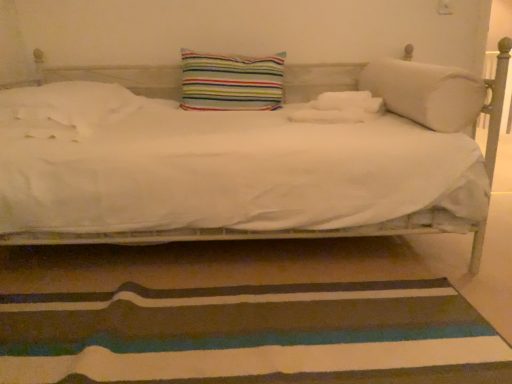
Question: Can we say striped fabric pillow at center, marked as the 2th pillow in a right-to-left arrangement, lies outside white soft cylindrical pillow at right, marked as the 3th pillow in a left-to-right arrangement?

Choices:
 (A) no
 (B) yes

Answer: (B)

Question: Is there a large distance between striped fabric pillow at center, marked as the 2th pillow in a right-to-left arrangement, and white soft cylindrical pillow at right, marked as the 3th pillow in a left-to-right arrangement?

Choices:
 (A) yes
 (B) no

Answer: (B)

Question: Is striped fabric pillow at center, arranged as the 2th pillow when viewed from the left, facing towards white soft cylindrical pillow at right, marked as the 3th pillow in a left-to-right arrangement?

Choices:
 (A) yes
 (B) no

Answer: (B)

Question: Does striped fabric pillow at center, arranged as the 2th pillow when viewed from the left, have a greater height compared to white soft cylindrical pillow at right, marked as the 3th pillow in a left-to-right arrangement?

Choices:
 (A) no
 (B) yes

Answer: (B)

Question: Is striped fabric pillow at center, arranged as the 2th pillow when viewed from the left, wider than white soft cylindrical pillow at right, marked as the 3th pillow in a left-to-right arrangement?

Choices:
 (A) yes
 (B) no

Answer: (B)

Question: Looking at the image, does striped fabric pillow at center, arranged as the 2th pillow when viewed from the left, seem bigger or smaller compared to white soft pillow at left, marked as the 3th pillow in a right-to-left arrangement?

Choices:
 (A) big
 (B) small

Answer: (B)

Question: From the image's perspective, is striped fabric pillow at center, marked as the 2th pillow in a right-to-left arrangement, positioned above or below white soft pillow at left, the 1th pillow positioned from the left?

Choices:
 (A) below
 (B) above

Answer: (B)

Question: Considering the positions of striped fabric pillow at center, marked as the 2th pillow in a right-to-left arrangement, and white soft pillow at left, the 1th pillow positioned from the left, in the image, is striped fabric pillow at center, marked as the 2th pillow in a right-to-left arrangement, taller or shorter than white soft pillow at left, the 1th pillow positioned from the left,?

Choices:
 (A) tall
 (B) short

Answer: (A)

Question: In terms of width, does striped fabric pillow at center, arranged as the 2th pillow when viewed from the left, look wider or thinner when compared to white soft pillow at left, the 1th pillow positioned from the left?

Choices:
 (A) wide
 (B) thin

Answer: (B)

Question: Would you say striped fabric pillow at center, arranged as the 2th pillow when viewed from the left, is to the left or to the right of striped fabric doormat at lower center in the picture?

Choices:
 (A) left
 (B) right

Answer: (A)

Question: Considering the positions of striped fabric pillow at center, marked as the 2th pillow in a right-to-left arrangement, and striped fabric doormat at lower center in the image, is striped fabric pillow at center, marked as the 2th pillow in a right-to-left arrangement, taller or shorter than striped fabric doormat at lower center?

Choices:
 (A) tall
 (B) short

Answer: (A)

Question: Looking at the image, does striped fabric pillow at center, arranged as the 2th pillow when viewed from the left, seem bigger or smaller compared to striped fabric doormat at lower center?

Choices:
 (A) big
 (B) small

Answer: (B)

Question: Relative to striped fabric doormat at lower center, is striped fabric pillow at center, arranged as the 2th pillow when viewed from the left, in front or behind?

Choices:
 (A) behind
 (B) front

Answer: (A)

Question: From a real-world perspective, is white soft pillow at left, marked as the 3th pillow in a right-to-left arrangement, physically located above or below striped fabric pillow at center, arranged as the 2th pillow when viewed from the left?

Choices:
 (A) below
 (B) above

Answer: (A)

Question: Considering the relative positions of white soft pillow at left, the 1th pillow positioned from the left, and striped fabric pillow at center, arranged as the 2th pillow when viewed from the left, in the image provided, is white soft pillow at left, the 1th pillow positioned from the left, to the left or to the right of striped fabric pillow at center, arranged as the 2th pillow when viewed from the left,?

Choices:
 (A) left
 (B) right

Answer: (A)